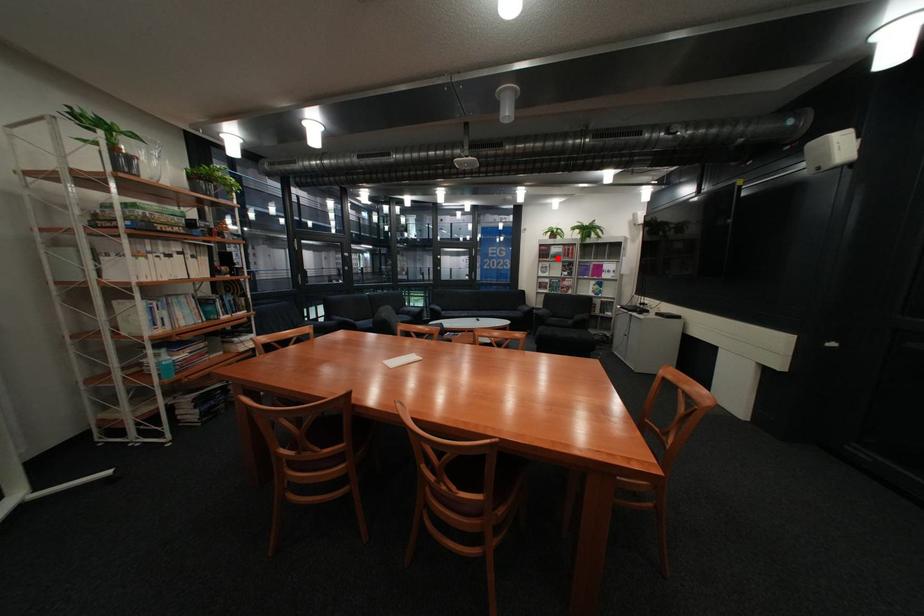
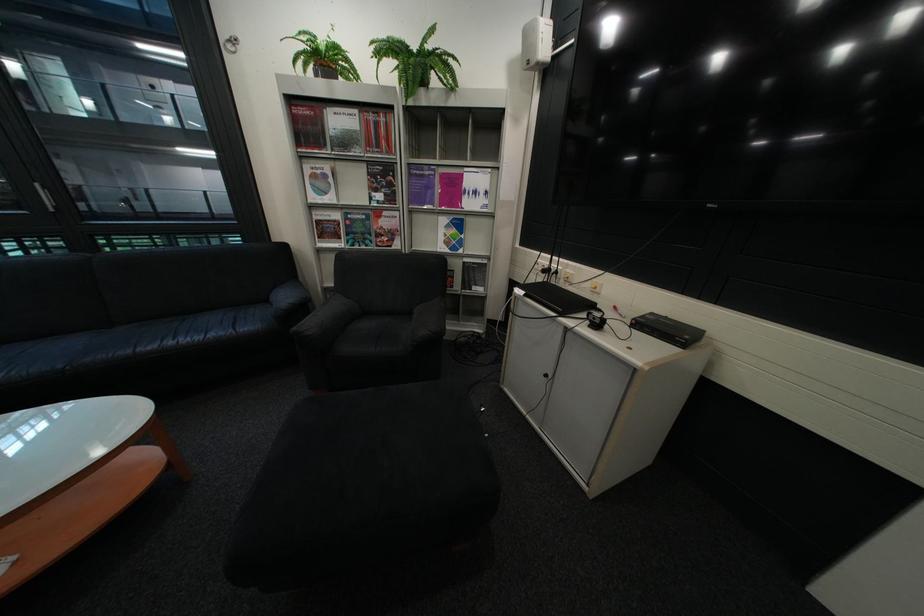
Where in the second image is the point corresponding to the highlighted location from the first image?

(322, 147)